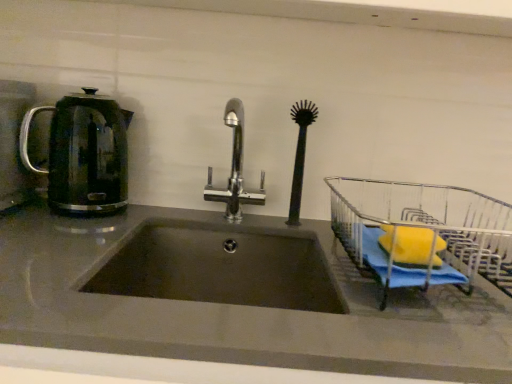
Question: Is dark gray matte sink at center placed right next to black rubber brush at center?

Choices:
 (A) yes
 (B) no

Answer: (B)

Question: Considering the relative sizes of dark gray matte sink at center and black rubber brush at center in the image provided, is dark gray matte sink at center bigger than black rubber brush at center?

Choices:
 (A) no
 (B) yes

Answer: (B)

Question: Is dark gray matte sink at center aimed at black rubber brush at center?

Choices:
 (A) no
 (B) yes

Answer: (A)

Question: Is black rubber brush at center a part of dark gray matte sink at center?

Choices:
 (A) no
 (B) yes

Answer: (A)

Question: From a real-world perspective, is dark gray matte sink at center under black rubber brush at center?

Choices:
 (A) no
 (B) yes

Answer: (B)

Question: Considering the relative positions of dark gray matte sink at center and black rubber brush at center in the image provided, is dark gray matte sink at center to the left of black rubber brush at center from the viewer's perspective?

Choices:
 (A) no
 (B) yes

Answer: (B)

Question: Is black rubber brush at center not inside dark gray matte sink at center?

Choices:
 (A) no
 (B) yes

Answer: (B)

Question: Can you confirm if black rubber brush at center is taller than dark gray matte sink at center?

Choices:
 (A) yes
 (B) no

Answer: (A)

Question: From a real-world perspective, is black rubber brush at center physically below dark gray matte sink at center?

Choices:
 (A) no
 (B) yes

Answer: (A)

Question: Is black rubber brush at center at the left side of dark gray matte sink at center?

Choices:
 (A) no
 (B) yes

Answer: (A)

Question: Does black rubber brush at center have a lesser height compared to dark gray matte sink at center?

Choices:
 (A) no
 (B) yes

Answer: (A)

Question: Is black rubber brush at center wider than dark gray matte sink at center?

Choices:
 (A) no
 (B) yes

Answer: (A)

Question: Is chrome metallic faucet at center beside translucent glass kettle at left?

Choices:
 (A) no
 (B) yes

Answer: (A)